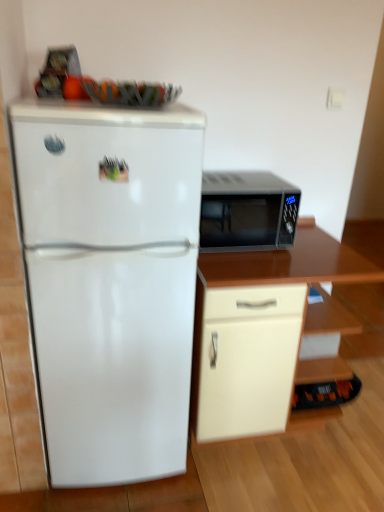
You are a GUI agent. You are given a task and a screenshot of the screen. Output one action in this format:
    pyautogui.click(x=<x>, y=<y>)
    Task: Click on the spots to the right of matte black microwave at right
    This screenshot has height=512, width=384.
    Given the screenshot: What is the action you would take?
    pyautogui.click(x=315, y=244)